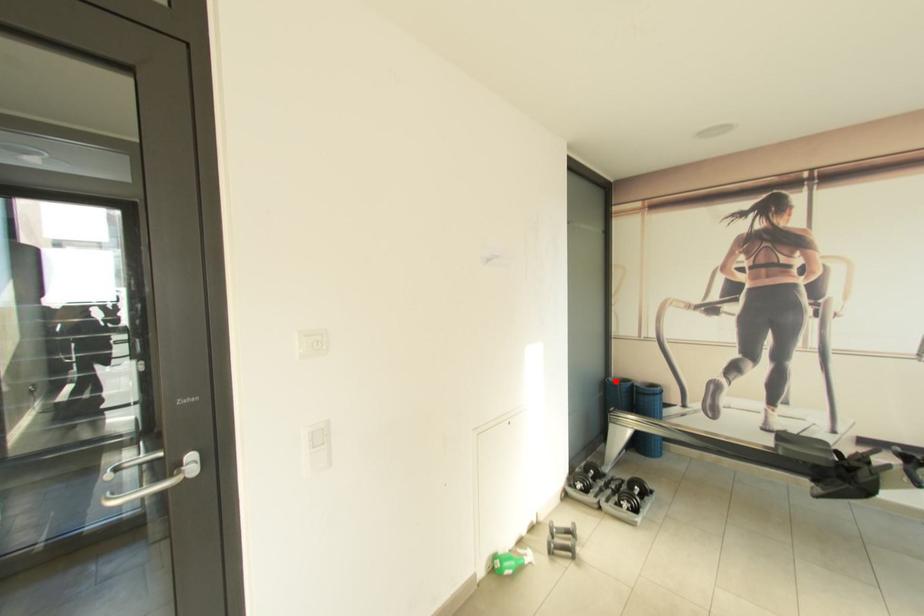
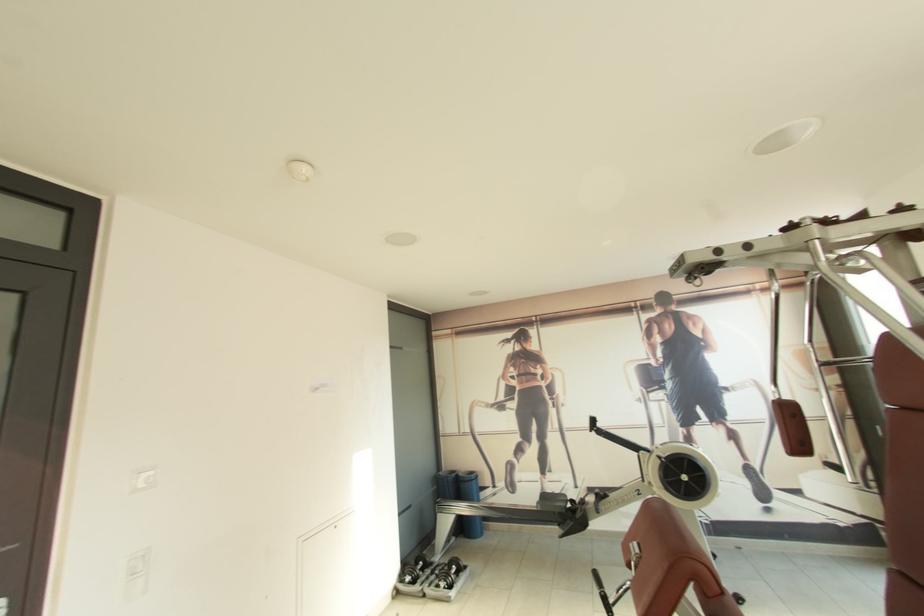
Locate, in the second image, the point that corresponds to the highlighted location in the first image.

(445, 475)